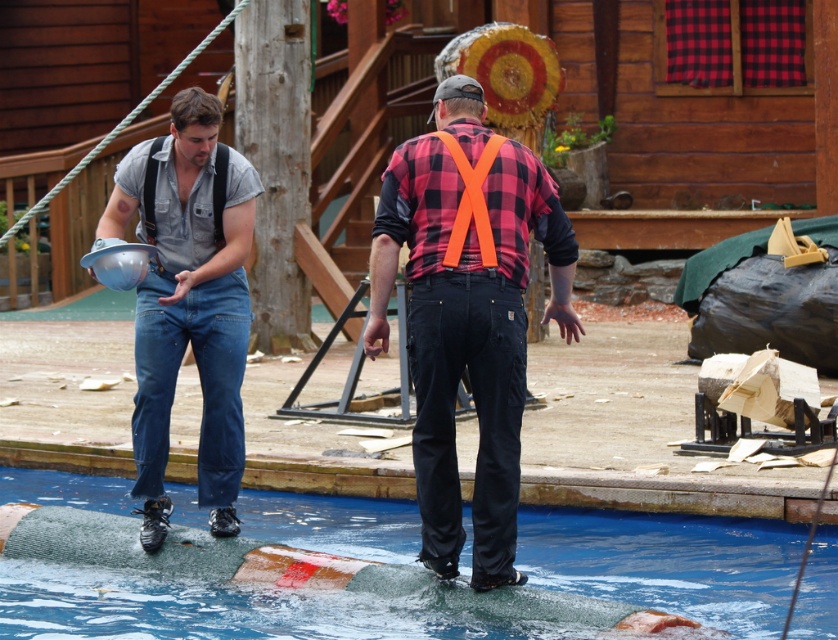
Question: Which point is closer to the camera?

Choices:
 (A) (65, 474)
 (B) (238, 483)
 (C) (371, 342)
 (D) (215, 147)

Answer: (C)

Question: Can you confirm if blue rubber mat at lower center is thinner than denim overalls at left?

Choices:
 (A) no
 (B) yes

Answer: (A)

Question: Which object is the farthest from the plaid fabric shirt at center?

Choices:
 (A) denim overalls at left
 (B) black fabric suspenders at left
 (C) blue rubber mat at lower center

Answer: (B)

Question: Is blue rubber mat at lower center smaller than denim overalls at left?

Choices:
 (A) yes
 (B) no

Answer: (A)

Question: Is plaid fabric shirt at center in front of denim overalls at left?

Choices:
 (A) no
 (B) yes

Answer: (B)

Question: Which object is closer to the camera taking this photo?

Choices:
 (A) black fabric suspenders at left
 (B) blue rubber mat at lower center
 (C) denim overalls at left
 (D) plaid fabric shirt at center

Answer: (D)